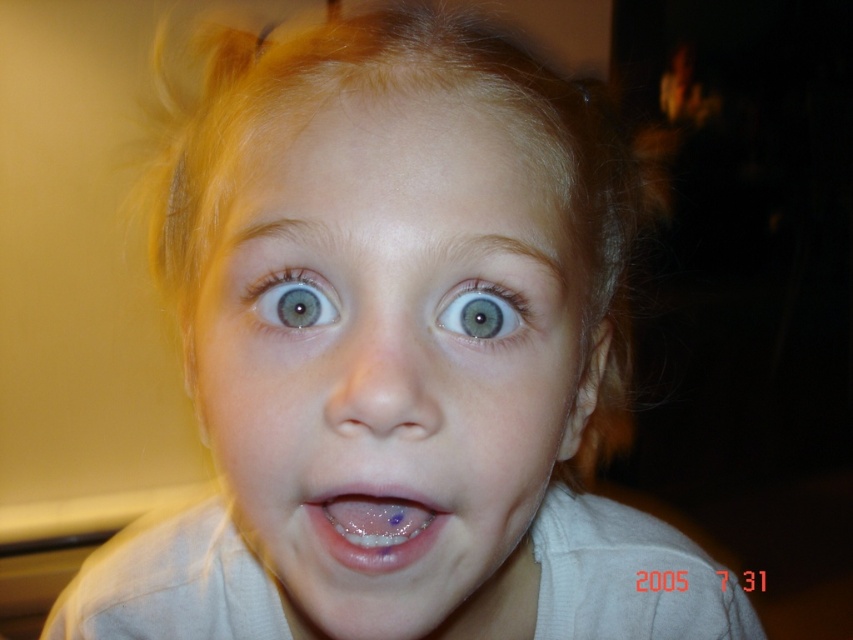
Based on the scene description, can you determine the spatial relationship between the smooth skin face at center and the blue glossy eye at center?

The smooth skin face at center is in front of the blue glossy eye at center, so the face is closer to the viewer than the eye.

Based on the scene description, which eye is positioned to the left when looking at the blue glossy eye at center and the blue matte eye at center?

The blue glossy eye at center is positioned to the left of the blue matte eye at center.